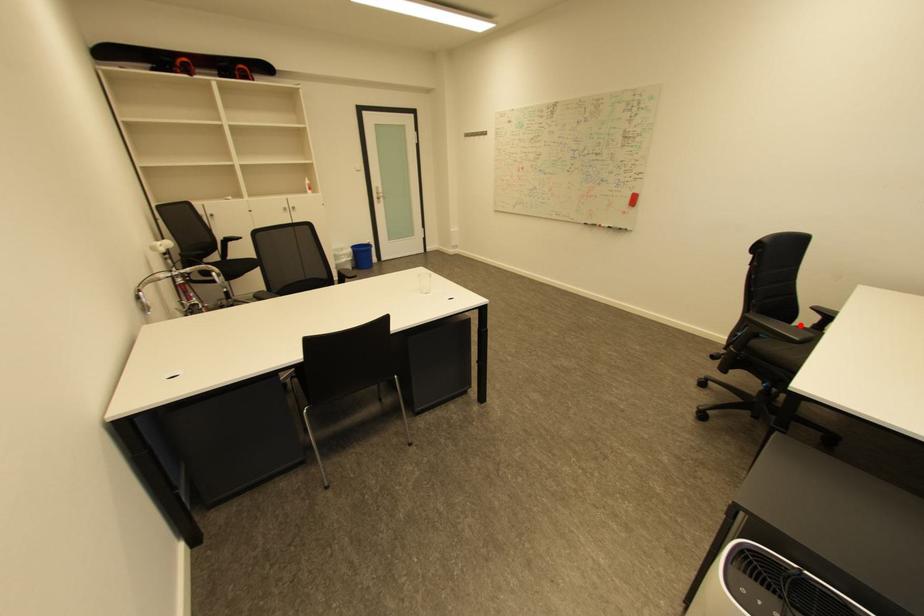
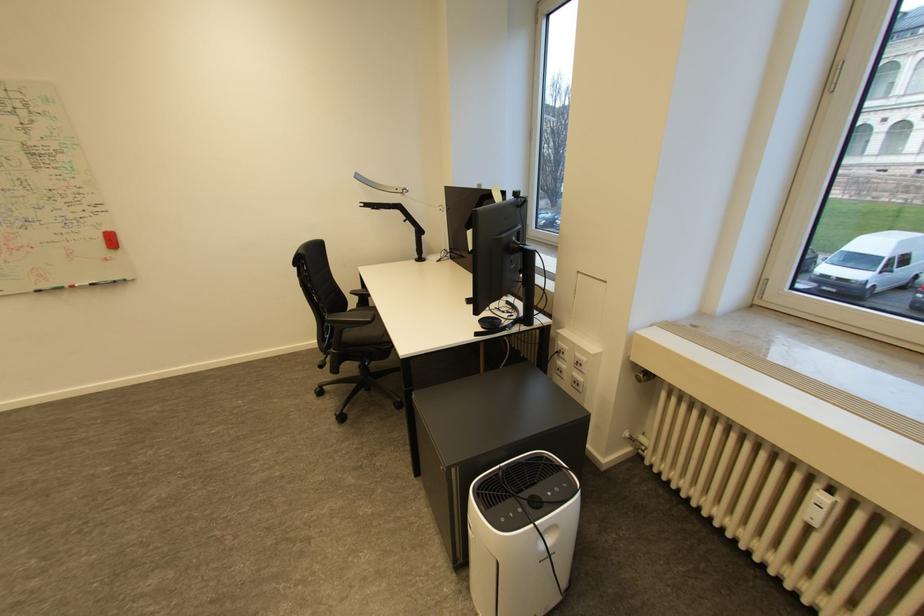
Question: A red point is marked in image1. In image2, is the corresponding 3D point closer to the camera or farther? Reply with the corresponding letter.

Choices:
 (A) The corresponding 3D point is closer.
 (B) The corresponding 3D point is farther.

Answer: (A)